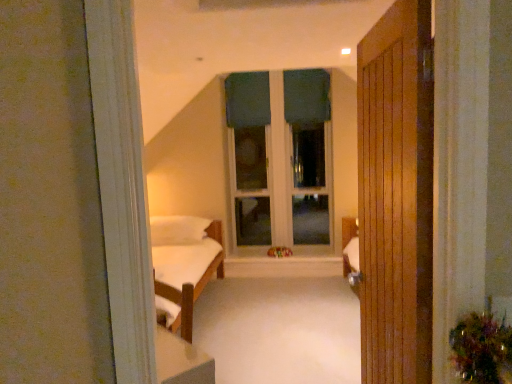
Question: Considering the relative positions of green fabric curtain at center, which appears as the first curtain when viewed from the left, and plush yellow teddy bear at center in the image provided, is green fabric curtain at center, which appears as the first curtain when viewed from the left, behind plush yellow teddy bear at center?

Choices:
 (A) yes
 (B) no

Answer: (A)

Question: Considering the relative sizes of green fabric curtain at center, which is the second curtain in right-to-left order, and plush yellow teddy bear at center in the image provided, is green fabric curtain at center, which is the second curtain in right-to-left order, shorter than plush yellow teddy bear at center?

Choices:
 (A) no
 (B) yes

Answer: (A)

Question: Is green fabric curtain at center, which appears as the first curtain when viewed from the left, positioned in front of plush yellow teddy bear at center?

Choices:
 (A) yes
 (B) no

Answer: (B)

Question: Is green fabric curtain at center, which is the second curtain in right-to-left order, oriented towards plush yellow teddy bear at center?

Choices:
 (A) no
 (B) yes

Answer: (A)

Question: Is green fabric curtain at center, which is the second curtain in right-to-left order, located outside plush yellow teddy bear at center?

Choices:
 (A) no
 (B) yes

Answer: (B)

Question: Is green fabric curtain at center, which is the second curtain in right-to-left order, thinner than plush yellow teddy bear at center?

Choices:
 (A) yes
 (B) no

Answer: (A)

Question: Is plush yellow teddy bear at center further to the viewer compared to wooden door at right?

Choices:
 (A) yes
 (B) no

Answer: (A)

Question: Is plush yellow teddy bear at center bigger than wooden door at right?

Choices:
 (A) no
 (B) yes

Answer: (A)

Question: Considering the relative sizes of plush yellow teddy bear at center and wooden door at right in the image provided, is plush yellow teddy bear at center shorter than wooden door at right?

Choices:
 (A) yes
 (B) no

Answer: (A)

Question: From the image's perspective, is plush yellow teddy bear at center located above wooden door at right?

Choices:
 (A) yes
 (B) no

Answer: (B)

Question: Is the surface of plush yellow teddy bear at center in direct contact with wooden door at right?

Choices:
 (A) yes
 (B) no

Answer: (B)

Question: Is plush yellow teddy bear at center positioned in front of wooden door at right?

Choices:
 (A) yes
 (B) no

Answer: (B)

Question: Is there a large distance between teal fabric window at center and white soft pillow at center?

Choices:
 (A) yes
 (B) no

Answer: (A)